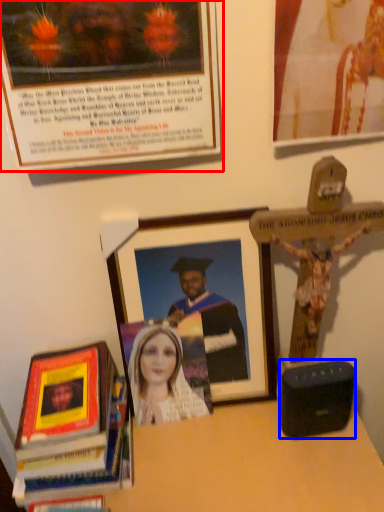
Question: Which point is closer to the camera, picture frame (highlighted by a red box) or speaker (highlighted by a blue box)?

Choices:
 (A) picture frame
 (B) speaker

Answer: (A)